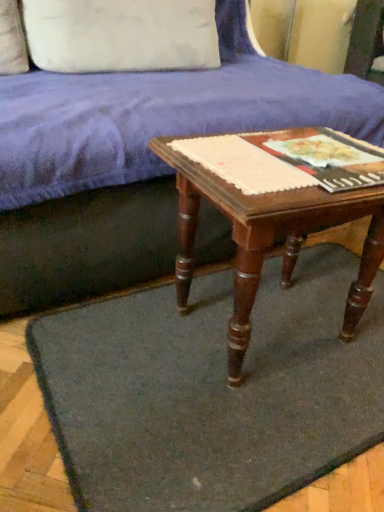
Question: In terms of width, does dark gray felt mat at center look wider or thinner when compared to matte paper at center, the first paperback book when ordered from right to left?

Choices:
 (A) thin
 (B) wide

Answer: (B)

Question: From the image's perspective, is dark gray felt mat at center located above or below matte paper at center, the 2th paperback book positioned from the left?

Choices:
 (A) above
 (B) below

Answer: (B)

Question: Based on their relative distances, which object is nearer to the velvet blue couch at upper center?

Choices:
 (A) white cotton pillow at upper left
 (B) wooden table at center
 (C) dark gray felt mat at center
 (D) matte paper at center, the 2th paperback book positioned from the left
 (E) matte paper at center, positioned as the first paperback book in left-to-right order

Answer: (B)

Question: Which object is the farthest from the matte paper at center, the 2th paperback book viewed from the right?

Choices:
 (A) dark gray felt mat at center
 (B) velvet blue couch at upper center
 (C) wooden table at center
 (D) matte paper at center, the 2th paperback book positioned from the left
 (E) white cotton pillow at upper left

Answer: (E)